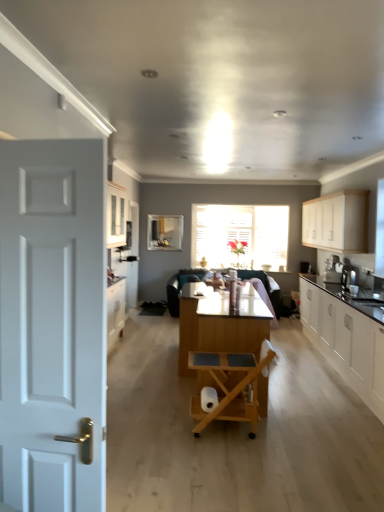
Question: Can you confirm if white matte toilet paper at center is positioned to the right of satin black coffee machine at right?

Choices:
 (A) yes
 (B) no

Answer: (B)

Question: Is white matte toilet paper at center bigger than satin black coffee machine at right?

Choices:
 (A) yes
 (B) no

Answer: (B)

Question: Is white matte toilet paper at center positioned with its back to satin black coffee machine at right?

Choices:
 (A) no
 (B) yes

Answer: (A)

Question: Does white matte toilet paper at center come in front of satin black coffee machine at right?

Choices:
 (A) yes
 (B) no

Answer: (A)

Question: From a real-world perspective, is white matte toilet paper at center below satin black coffee machine at right?

Choices:
 (A) no
 (B) yes

Answer: (B)

Question: Can you confirm if white matte toilet paper at center is shorter than satin black coffee machine at right?

Choices:
 (A) no
 (B) yes

Answer: (B)

Question: Is white painted wood door at left smaller than wooden table at center?

Choices:
 (A) yes
 (B) no

Answer: (A)

Question: Is white painted wood door at left bigger than wooden table at center?

Choices:
 (A) yes
 (B) no

Answer: (B)

Question: Does white painted wood door at left have a greater height compared to wooden table at center?

Choices:
 (A) no
 (B) yes

Answer: (B)

Question: Does white painted wood door at left have a lesser width compared to wooden table at center?

Choices:
 (A) yes
 (B) no

Answer: (A)

Question: From a real-world perspective, does white painted wood door at left stand above wooden table at center?

Choices:
 (A) no
 (B) yes

Answer: (B)

Question: Is white painted wood door at left positioned in front of wooden table at center?

Choices:
 (A) no
 (B) yes

Answer: (B)

Question: From a real-world perspective, is satin black coffee machine at right over clear glass window screen at center?

Choices:
 (A) yes
 (B) no

Answer: (B)